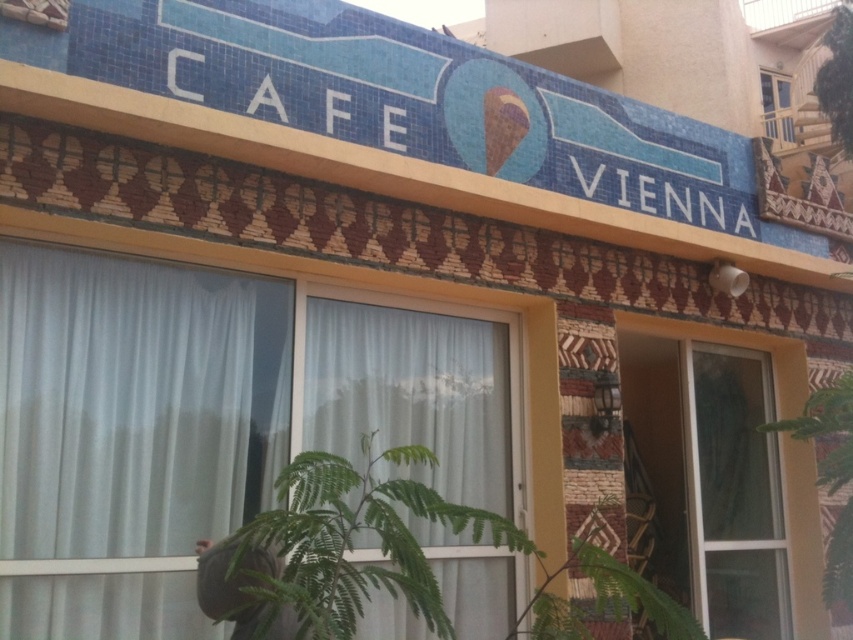
How much distance is there between white sheer curtain at lower left and clear glass window at upper right?

A distance of 18.30 feet exists between white sheer curtain at lower left and clear glass window at upper right.

Is point (196, 611) positioned after point (787, 97)?

No, (196, 611) is closer to viewer.

Describe the element at coordinates (134, 403) in the screenshot. I see `white sheer curtain at lower left` at that location.

Locate an element on the screen. The height and width of the screenshot is (640, 853). white sheer curtain at lower left is located at coordinates (134, 403).

Is transparent glass door at center wider than dark gray fabric cap at lower center?

Indeed, transparent glass door at center has a greater width compared to dark gray fabric cap at lower center.

Which is above, transparent glass door at center or dark gray fabric cap at lower center?

transparent glass door at center is higher up.

You are a GUI agent. You are given a task and a screenshot of the screen. Output one action in this format:
    pyautogui.click(x=<x>, y=<y>)
    Task: Click on the transparent glass door at center
    This screenshot has width=853, height=640.
    Given the screenshot: What is the action you would take?
    (728, 470)

What are the coordinates of `transparent glass door at center` in the screenshot? It's located at (728, 470).

Is white sheer curtain at lower left further to camera compared to dark gray fabric cap at lower center?

Yes, it is behind dark gray fabric cap at lower center.

In order to click on white sheer curtain at lower left in this screenshot , I will do `click(134, 403)`.